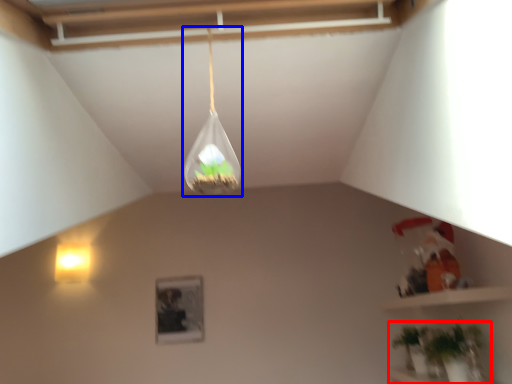
Question: Which object is further to the camera taking this photo, houseplant (highlighted by a red box) or lamp (highlighted by a blue box)?

Choices:
 (A) houseplant
 (B) lamp

Answer: (A)